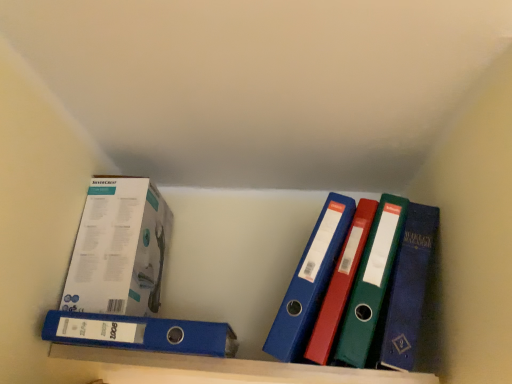
In the scene shown: What is the approximate width of blue plastic binder at lower left?

blue plastic binder at lower left is 12.20 inches wide.

The image size is (512, 384). What are the coordinates of `white cardboard box at upper left` in the screenshot? It's located at (119, 249).

Which is more to the right, blue plastic binder at lower left or blue plastic shelf at lower center?

blue plastic shelf at lower center.

From their relative heights in the image, would you say blue plastic binder at lower left is taller or shorter than blue plastic shelf at lower center?

Considering their sizes, blue plastic binder at lower left has more height than blue plastic shelf at lower center.

Is point (217, 334) positioned behind point (153, 362)?

No.

Is blue plastic binder at lower left inside the boundaries of blue plastic shelf at lower center, or outside?

blue plastic binder at lower left lies outside blue plastic shelf at lower center.

Is white cardboard box at upper left situated inside blue plastic binder at lower left or outside?

white cardboard box at upper left cannot be found inside blue plastic binder at lower left.

How many degrees apart are the facing directions of white cardboard box at upper left and blue plastic binder at lower left?

They differ by 0.0831 degrees in their facing directions.

Can you confirm if white cardboard box at upper left is shorter than blue plastic binder at lower left?

In fact, white cardboard box at upper left may be taller than blue plastic binder at lower left.

Can you confirm if blue plastic binder at lower left is positioned to the left of white cardboard box at upper left?

No, blue plastic binder at lower left is not to the left of white cardboard box at upper left.

Looking at this image, in terms of size, does blue plastic binder at lower left appear bigger or smaller than white cardboard box at upper left?

In the image, blue plastic binder at lower left appears to be smaller than white cardboard box at upper left.

From the picture: Considering the sizes of blue plastic binder at lower left and white cardboard box at upper left in the image, is blue plastic binder at lower left taller or shorter than white cardboard box at upper left?

Considering their sizes, blue plastic binder at lower left has less height than white cardboard box at upper left.

You are a GUI agent. You are given a task and a screenshot of the screen. Output one action in this format:
    pyautogui.click(x=<x>, y=<y>)
    Task: Click on the box that appears above the blue plastic binder at lower left (from a real-world perspective)
    This screenshot has width=512, height=384.
    Given the screenshot: What is the action you would take?
    pyautogui.click(x=119, y=249)

At what (x,y) coordinates should I click in order to perform the action: click on box above the blue plastic shelf at lower center (from a real-world perspective). Please return your answer as a coordinate pair (x, y). Looking at the image, I should click on (119, 249).

Which is correct: blue plastic shelf at lower center is inside white cardboard box at upper left, or outside of it?

blue plastic shelf at lower center lies outside white cardboard box at upper left.

Is blue plastic shelf at lower center taller than white cardboard box at upper left?

Incorrect, the height of blue plastic shelf at lower center is not larger of that of white cardboard box at upper left.

Can you see blue plastic shelf at lower center touching white cardboard box at upper left?

No, blue plastic shelf at lower center is not touching white cardboard box at upper left.

Between white cardboard box at upper left and blue plastic shelf at lower center, which one has less height?

With less height is blue plastic shelf at lower center.

What's the angular difference between white cardboard box at upper left and blue plastic shelf at lower center's facing directions?

They differ by 2.24 degrees in their facing directions.

In the scene shown: From a real-world perspective, is white cardboard box at upper left physically above blue plastic shelf at lower center?

Correct, in the physical world, white cardboard box at upper left is higher than blue plastic shelf at lower center.

Considering the relative positions of white cardboard box at upper left and blue plastic shelf at lower center in the image provided, is white cardboard box at upper left behind blue plastic shelf at lower center?

Yes, white cardboard box at upper left is further from the viewer.

Is blue plastic shelf at lower center placed right next to blue plastic binder at lower left?

Yes, blue plastic shelf at lower center is next to blue plastic binder at lower left.

Is blue plastic shelf at lower center inside or outside of blue plastic binder at lower left?

The correct answer is: outside.

At what (x,y) coordinates should I click in order to perform the action: click on binder located in front of the blue plastic shelf at lower center. Please return your answer as a coordinate pair (x, y). This screenshot has width=512, height=384. Looking at the image, I should click on (140, 333).

Is blue plastic shelf at lower center positioned with its back to blue plastic binder at lower left?

No, blue plastic shelf at lower center is not facing the opposite direction of blue plastic binder at lower left.

The image size is (512, 384). In order to click on shelf below the blue plastic binder at lower left (from a real-world perspective) in this screenshot , I will do `click(225, 368)`.

Identify the location of binder in front of the white cardboard box at upper left. (140, 333).

When comparing their distances from blue plastic shelf at lower center, does white cardboard box at upper left or blue plastic binder at lower left seem further?

The object further to blue plastic shelf at lower center is white cardboard box at upper left.

Based on their spatial positions, is blue plastic shelf at lower center or white cardboard box at upper left further from blue plastic binder at lower left?

Among the two, white cardboard box at upper left is located further to blue plastic binder at lower left.

Based on their spatial positions, is white cardboard box at upper left or blue plastic shelf at lower center closer to blue plastic binder at lower left?

Based on the image, blue plastic shelf at lower center appears to be nearer to blue plastic binder at lower left.

Considering their positions, is blue plastic shelf at lower center positioned further to white cardboard box at upper left than blue plastic binder at lower left?

The object further to white cardboard box at upper left is blue plastic shelf at lower center.

Based on the photo, based on their spatial positions, is blue plastic binder at lower left or blue plastic shelf at lower center further from white cardboard box at upper left?

blue plastic shelf at lower center lies further to white cardboard box at upper left than the other object.

When comparing their distances from blue plastic shelf at lower center, does blue plastic binder at lower left or white cardboard box at upper left seem closer?

The object closer to blue plastic shelf at lower center is blue plastic binder at lower left.

You are a GUI agent. You are given a task and a screenshot of the screen. Output one action in this format:
    pyautogui.click(x=<x>, y=<y>)
    Task: Click on the binder between white cardboard box at upper left and blue plastic shelf at lower center from left to right
    The width and height of the screenshot is (512, 384).
    Given the screenshot: What is the action you would take?
    pyautogui.click(x=140, y=333)